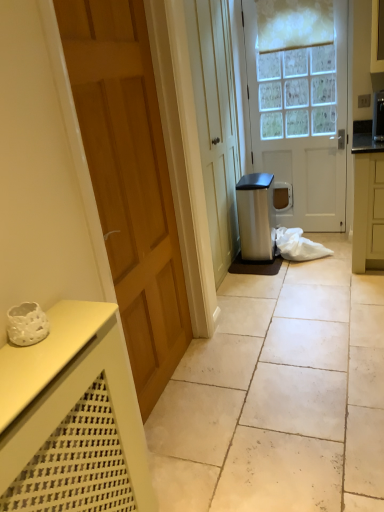
Question: Is wooden door at left, which is the second door in back-to-front order, in front of or behind satin silver trash can at center-right in the image?

Choices:
 (A) front
 (B) behind

Answer: (A)

Question: Looking at the image, does wooden door at left, which appears as the 1th door when viewed from the front, seem bigger or smaller compared to satin silver trash can at center-right?

Choices:
 (A) small
 (B) big

Answer: (B)

Question: Which object is the closest to the satin silver trash can at center-right?

Choices:
 (A) white tile floor at center
 (B) wooden door at left, which is the second door in back-to-front order
 (C) white glossy door at center, which is the second door from front to back
 (D) white fabric at center

Answer: (D)

Question: Estimate the real-world distances between objects in this image. Which object is closer to the white glossy door at center, which is the second door from front to back?

Choices:
 (A) white fabric at center
 (B) wooden door at left, which appears as the 1th door when viewed from the front
 (C) white tile floor at center
 (D) satin silver trash can at center-right

Answer: (D)